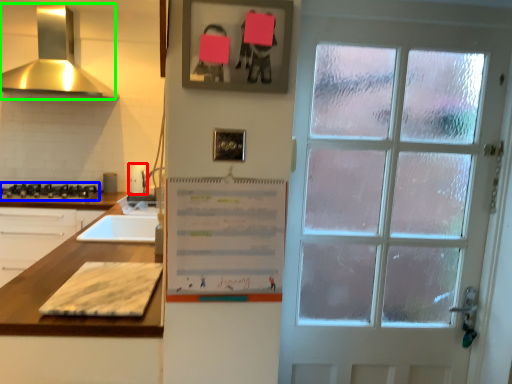
Question: Which object is positioned farthest from appliance (highlighted by a red box)? Select from gas stove (highlighted by a blue box) and exhaust hood (highlighted by a green box).

Choices:
 (A) gas stove
 (B) exhaust hood

Answer: (B)